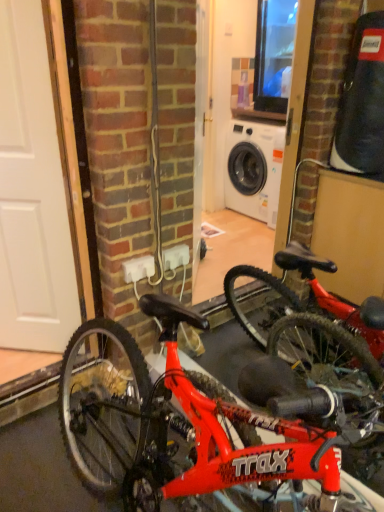
Question: Can you confirm if white plastic electric outlet at center is wider than shiny red bicycle at center?

Choices:
 (A) no
 (B) yes

Answer: (A)

Question: Considering the relative sizes of white plastic electric outlet at center and shiny red bicycle at center in the image provided, is white plastic electric outlet at center smaller than shiny red bicycle at center?

Choices:
 (A) no
 (B) yes

Answer: (B)

Question: Can you confirm if white plastic electric outlet at center is positioned to the left of shiny red bicycle at center?

Choices:
 (A) no
 (B) yes

Answer: (B)

Question: Can you confirm if white plastic electric outlet at center is shorter than shiny red bicycle at center?

Choices:
 (A) yes
 (B) no

Answer: (A)

Question: Does white plastic electric outlet at center have a larger size compared to shiny red bicycle at center?

Choices:
 (A) no
 (B) yes

Answer: (A)

Question: From the image's perspective, is shiny red bicycle at center positioned above or below white matte door at left?

Choices:
 (A) above
 (B) below

Answer: (B)

Question: Is point click(311, 330) closer or farther from the camera than point click(41, 330)?

Choices:
 (A) farther
 (B) closer

Answer: (A)

Question: Is shiny red bicycle at center to the left or to the right of white matte door at left in the image?

Choices:
 (A) left
 (B) right

Answer: (B)

Question: From a real-world perspective, is shiny red bicycle at center positioned above or below white matte door at left?

Choices:
 (A) above
 (B) below

Answer: (B)

Question: In the image, is white plastic electric outlet at center on the left side or the right side of white matte door at left?

Choices:
 (A) left
 (B) right

Answer: (B)

Question: From the image's perspective, is white plastic electric outlet at center positioned above or below white matte door at left?

Choices:
 (A) above
 (B) below

Answer: (B)

Question: Considering the positions of white plastic electric outlet at center and white matte door at left in the image, is white plastic electric outlet at center taller or shorter than white matte door at left?

Choices:
 (A) tall
 (B) short

Answer: (B)

Question: Relative to white matte door at left, is white plastic electric outlet at center in front or behind?

Choices:
 (A) behind
 (B) front

Answer: (A)

Question: In terms of size, does white matte door at left appear bigger or smaller than white plastic electric outlet at center?

Choices:
 (A) small
 (B) big

Answer: (B)

Question: Is point (51, 116) positioned closer to the camera than point (147, 272)?

Choices:
 (A) closer
 (B) farther

Answer: (A)